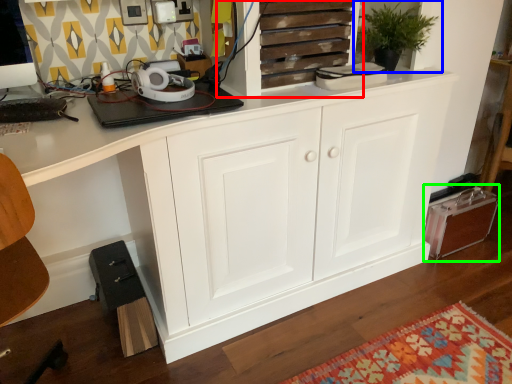
Question: Which object is positioned farthest from cupboard (highlighted by a red box)? Select from houseplant (highlighted by a blue box) and cabinetry (highlighted by a green box).

Choices:
 (A) houseplant
 (B) cabinetry

Answer: (B)